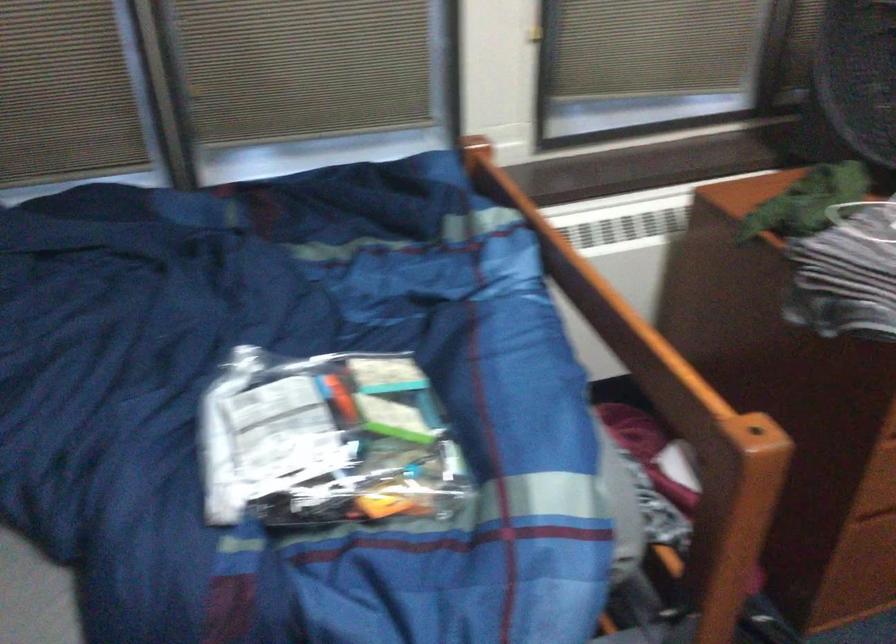
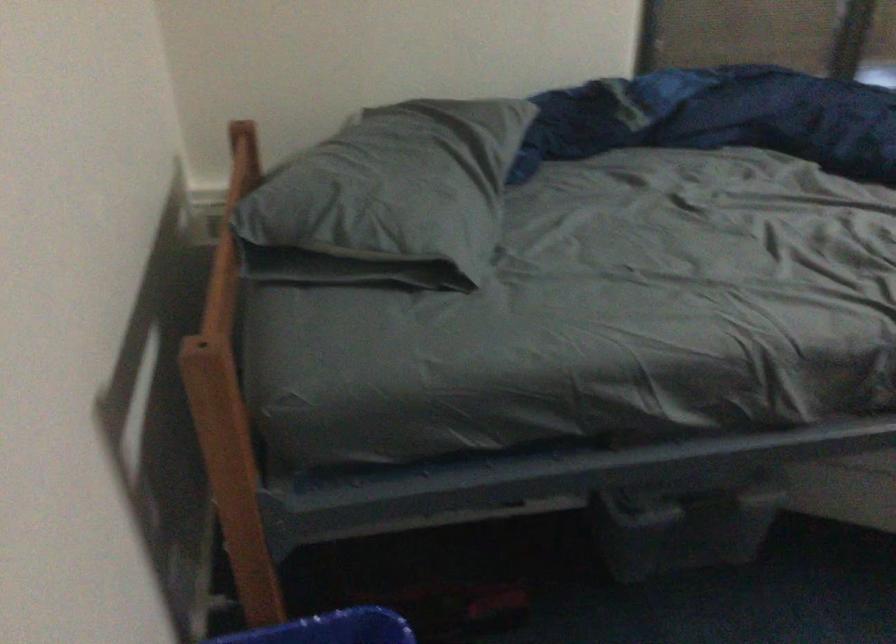
Based on the photo, in a continuous first-person perspective shot, in which direction is the camera moving?

The cameraman walked toward left, backward.